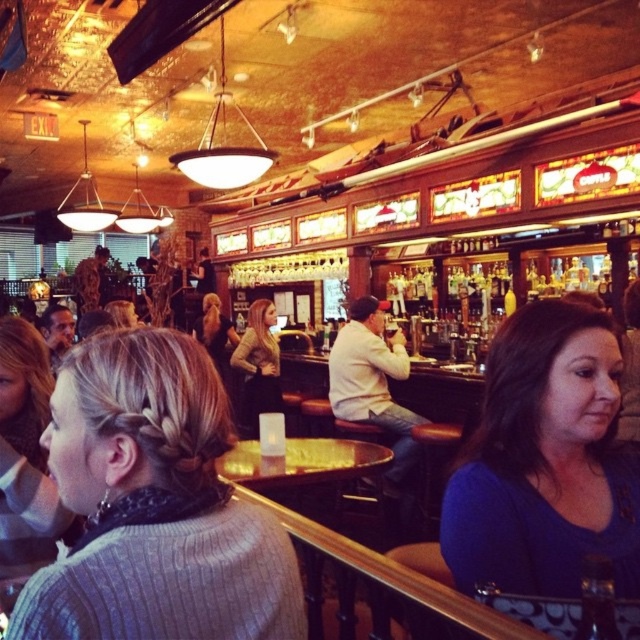
Question: From the image, what is the correct spatial relationship of golden textured sweater at center in relation to blonde hair at center?

Choices:
 (A) below
 (B) above

Answer: (A)

Question: Is knitted sweater at center to the right of golden textured sweater at center from the viewer's perspective?

Choices:
 (A) no
 (B) yes

Answer: (B)

Question: Which object is closer to the camera taking this photo?

Choices:
 (A) golden textured sweater at center
 (B) knitted sweater at center

Answer: (B)

Question: Which object is positioned farthest from the golden textured sweater at center?

Choices:
 (A) blue matte shirt at center
 (B) knitted sweater at center

Answer: (B)

Question: Can you confirm if knitted sweater at center is positioned below golden textured sweater at center?

Choices:
 (A) no
 (B) yes

Answer: (A)

Question: Which of these objects is positioned closest to the golden textured sweater at center?

Choices:
 (A) knitted sweater at center
 (B) blonde hair at center
 (C) blue matte shirt at center

Answer: (B)